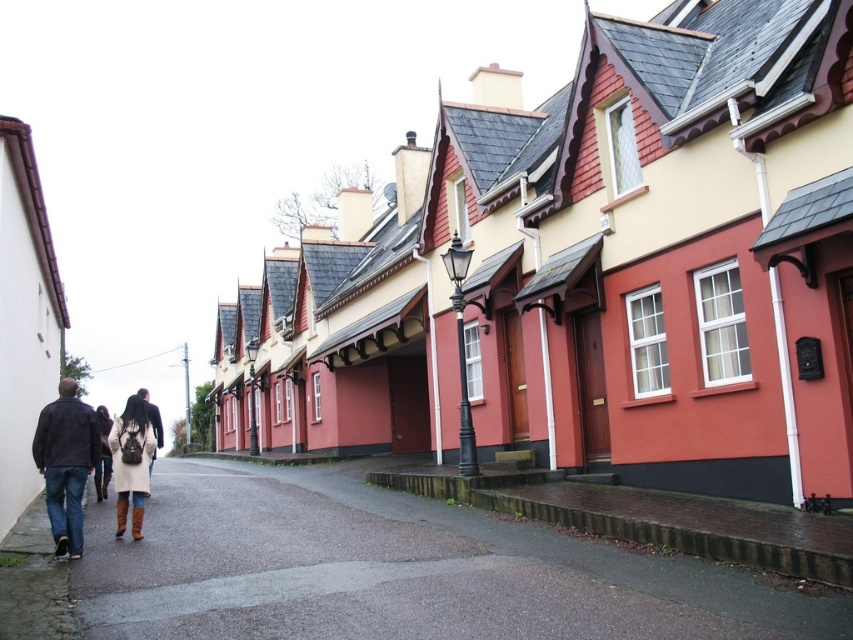
Consider the image. Does gray asphalt pavement at lower left have a greater width compared to dark brown leather jacket at lower left?

Correct, the width of gray asphalt pavement at lower left exceeds that of dark brown leather jacket at lower left.

Which is in front, point (276, 531) or point (57, 518)?

Positioned in front is point (57, 518).

Who is more distant from viewer, (x=624, y=580) or (x=50, y=486)?

The point (x=50, y=486) is behind.

What are the coordinates of `gray asphalt pavement at lower left` in the screenshot? It's located at (403, 570).

Is dark brown leather jacket at lower left shorter than leather boots at lower left?

Correct, dark brown leather jacket at lower left is not as tall as leather boots at lower left.

Can you confirm if dark brown leather jacket at lower left is positioned to the right of leather boots at lower left?

Correct, you'll find dark brown leather jacket at lower left to the right of leather boots at lower left.

In order to click on dark brown leather jacket at lower left in this screenshot , I will do `click(65, 464)`.

Does point (97, 499) come farther from viewer compared to point (158, 433)?

Yes, point (97, 499) is behind point (158, 433).

Which is above, leather boots at lower left or dark brown leather jacket at center?

dark brown leather jacket at center is higher up.

Locate an element on the screen. The image size is (853, 640). leather boots at lower left is located at coordinates (102, 454).